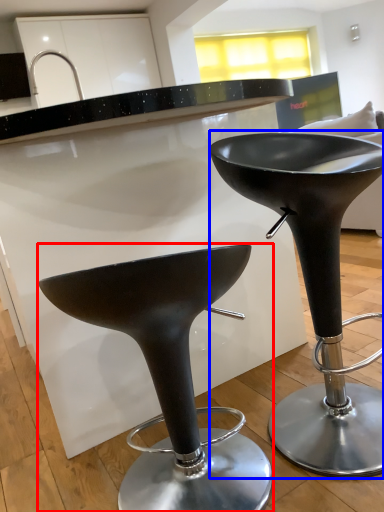
Question: Which object is further to the camera taking this photo, stool (highlighted by a red box) or stool (highlighted by a blue box)?

Choices:
 (A) stool
 (B) stool

Answer: (B)